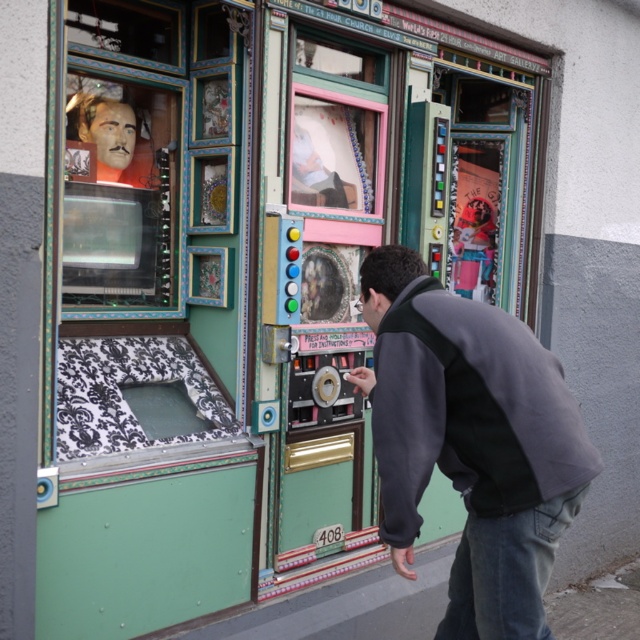
Question: Does dark gray fleece at center have a smaller size compared to denim at lower right?

Choices:
 (A) no
 (B) yes

Answer: (A)

Question: Which object is closer to the camera taking this photo?

Choices:
 (A) dark gray fleece at center
 (B) denim at lower right

Answer: (A)

Question: Which of the following is the closest to the observer?

Choices:
 (A) (474, 570)
 (B) (504, 637)

Answer: (B)

Question: Which object is closer to the camera taking this photo?

Choices:
 (A) dark gray fleece at center
 (B) denim at lower right

Answer: (A)

Question: Where is dark gray fleece at center located in relation to denim at lower right in the image?

Choices:
 (A) left
 (B) right

Answer: (A)

Question: Is dark gray fleece at center further to the viewer compared to denim at lower right?

Choices:
 (A) no
 (B) yes

Answer: (A)